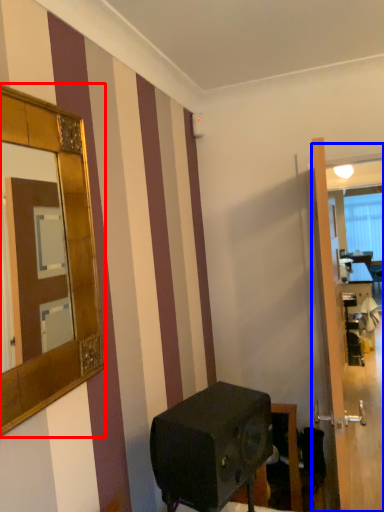
Question: Which point is closer to the camera, mirror (highlighted by a red box) or glass door (highlighted by a blue box)?

Choices:
 (A) mirror
 (B) glass door

Answer: (A)